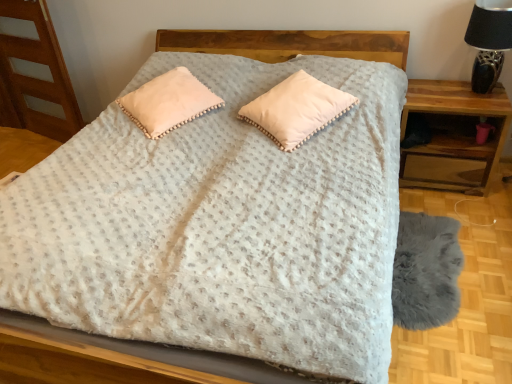
Question: From a real-world perspective, is peach velvety pillow at center, positioned as the 2th pillow in right-to-left order, physically located above or below wooden nightstand at right?

Choices:
 (A) below
 (B) above

Answer: (B)

Question: Would you say peach velvety pillow at center, positioned as the 2th pillow in right-to-left order, is to the left or to the right of wooden nightstand at right in the picture?

Choices:
 (A) left
 (B) right

Answer: (A)

Question: Which object is the closest to the wooden nightstand at right?

Choices:
 (A) black ceramic table lamp at upper right
 (B) gray fluffy rug at lower right
 (C) peach velvety pillow at center, positioned as the 2th pillow in right-to-left order
 (D) pom-pom trim pillow at center, acting as the first pillow starting from the right

Answer: (A)

Question: Which of these objects is positioned farthest from the gray fluffy rug at lower right?

Choices:
 (A) black ceramic table lamp at upper right
 (B) pom-pom trim pillow at center, acting as the first pillow starting from the right
 (C) peach velvety pillow at center, positioned as the 1th pillow in left-to-right order
 (D) wooden nightstand at right

Answer: (C)